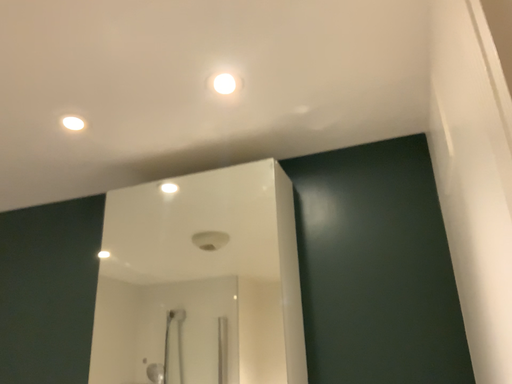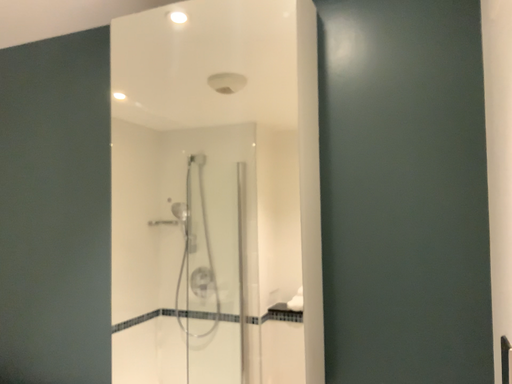
Question: Which way did the camera rotate in the video?

Choices:
 (A) rotated upward
 (B) rotated downward

Answer: (B)